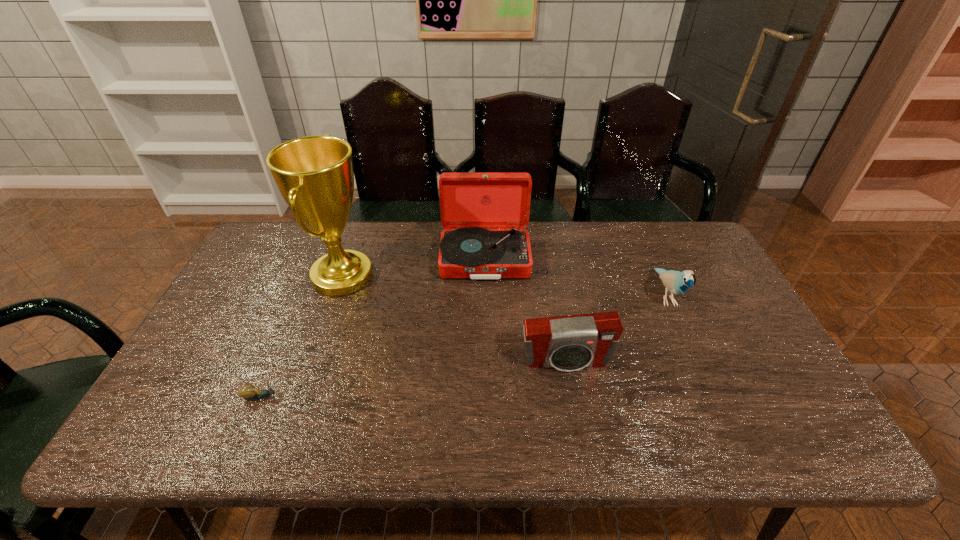
The height and width of the screenshot is (540, 960). Find the location of `award`. award is located at coordinates (314, 174).

I want to click on phonograph_record, so click(x=484, y=213).

This screenshot has width=960, height=540. Identify the location of the rightmost object. (676, 282).

Identify the location of the second nearest object. This screenshot has width=960, height=540. (569, 343).

Identify the location of the nearest object. (249, 392).

The width and height of the screenshot is (960, 540). I want to click on escargot, so click(249, 392).

Find the location of a particular element. Image resolution: width=960 pixels, height=540 pixels. free point located 0.170m by the handles of the tallest object is located at coordinates (431, 276).

Identify the location of vacant area located on the front-facing side of the second tallest object. The image size is (960, 540). (486, 330).

Where is `vacant space located 0.100m at the face of the rightmost object`? This screenshot has height=540, width=960. vacant space located 0.100m at the face of the rightmost object is located at coordinates (691, 352).

Identify the location of free space located on the front-facing side of the fourth farthest object. click(x=580, y=441).